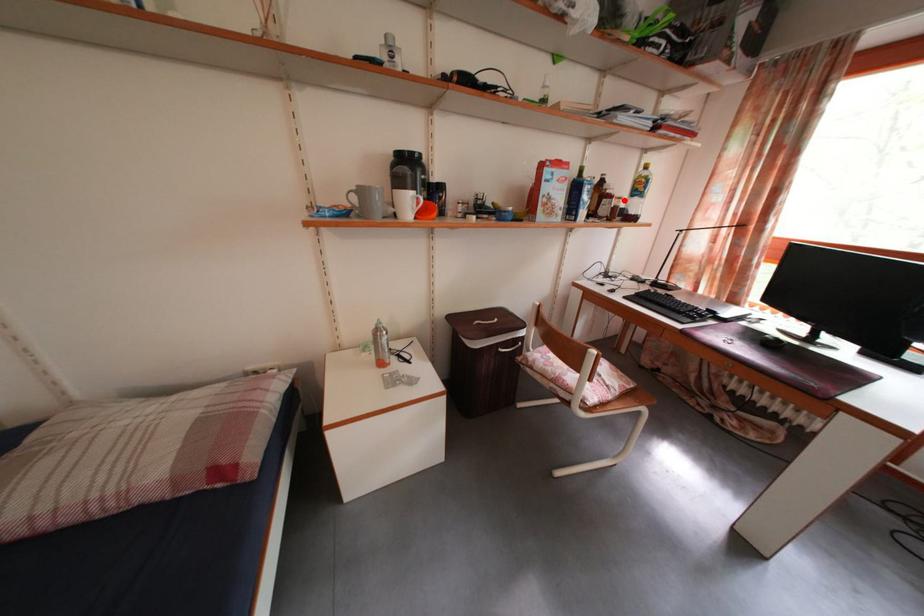
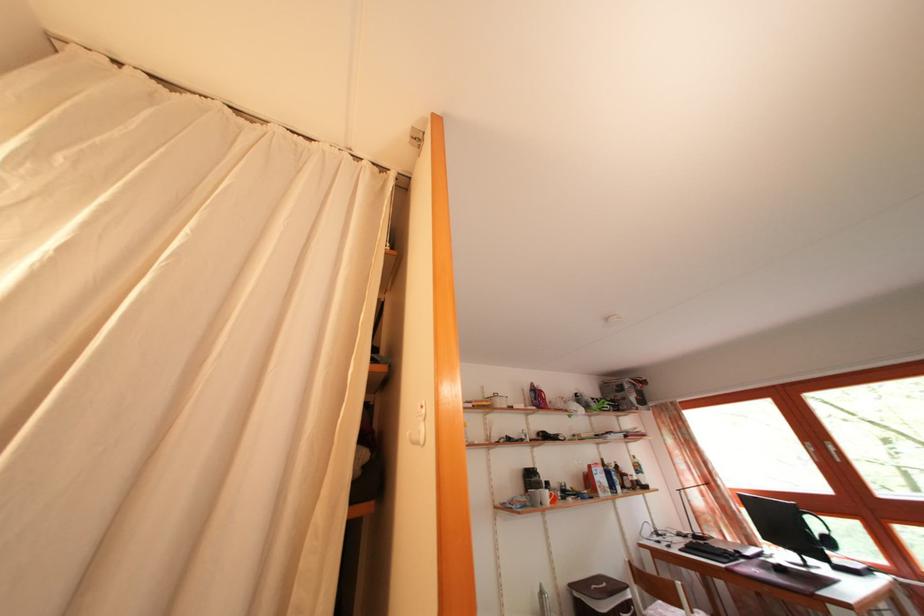
Question: I am providing you with two images of the same scene from different viewpoints. Image1 has a red point marked. In image2, the corresponding 3D location appears at what relative position? Reply with the corresponding letter.

Choices:
 (A) Closer
 (B) Farther

Answer: (B)